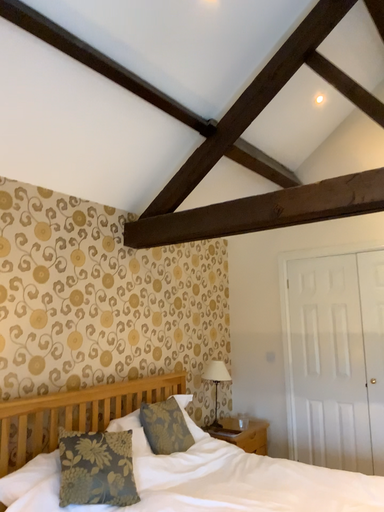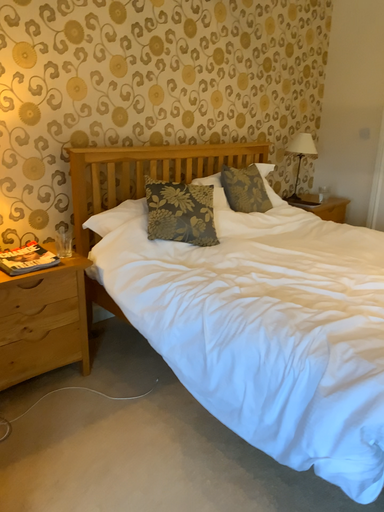
Question: Which way did the camera rotate in the video?

Choices:
 (A) rotated downward
 (B) rotated upward

Answer: (A)